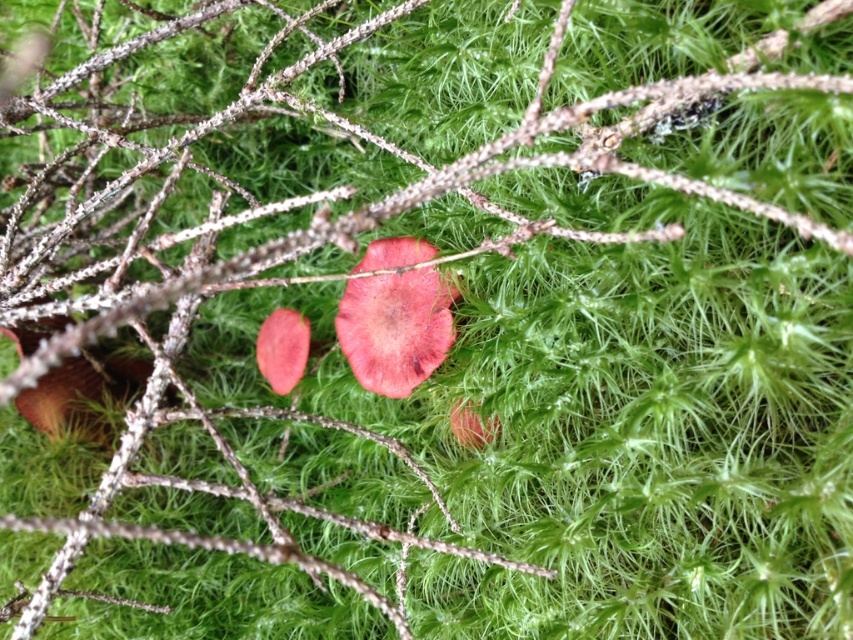
Question: Observing the image, what is the correct spatial positioning of matte pink petal at center in reference to glossy pink petal at center?

Choices:
 (A) above
 (B) below

Answer: (A)

Question: Can you confirm if glossy red mushroom at center is thinner than matte pink petal at center?

Choices:
 (A) no
 (B) yes

Answer: (A)

Question: Among these objects, which one is nearest to the camera?

Choices:
 (A) glossy red mushroom at center
 (B) matte pink petal at center
 (C) glossy pink petal at center

Answer: (C)

Question: Which point appears farthest from the camera in this image?

Choices:
 (A) (492, 436)
 (B) (296, 349)

Answer: (B)

Question: Considering the real-world distances, which object is farthest from the glossy pink petal at center?

Choices:
 (A) matte pink petal at center
 (B) glossy red mushroom at center

Answer: (A)

Question: In this image, where is matte pink petal at center located relative to glossy pink petal at center?

Choices:
 (A) below
 (B) above

Answer: (B)